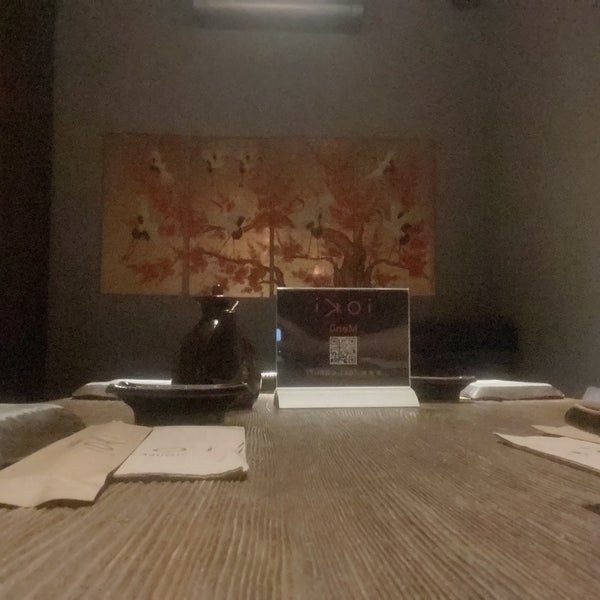
What are the coordinates of `empty wall` in the screenshot? It's located at (558, 220).